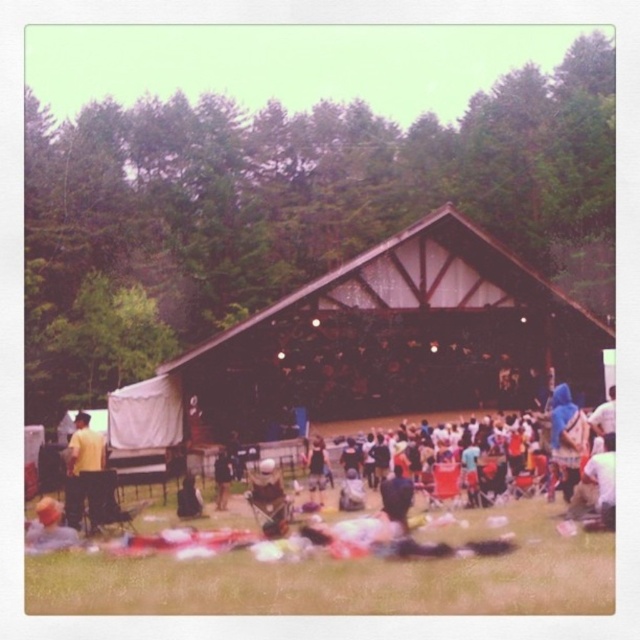
In the scene shown: You are attending an outdoor event and see the blue fabric at right and the dark brown leather jacket at center. Which object is positioned higher in the image?

The blue fabric at right is above the dark brown leather jacket at center, so the blue fabric at right is positioned higher.

You are standing in the crowd at the outdoor event. You notice two points in the scene. One is at coordinate point (605, 422) and the other is at point (218, 497). Which point is closer to your current position?

Point (605, 422) is closer to the camera than point (218, 497), so the point at (605, 422) is closer to your current position.